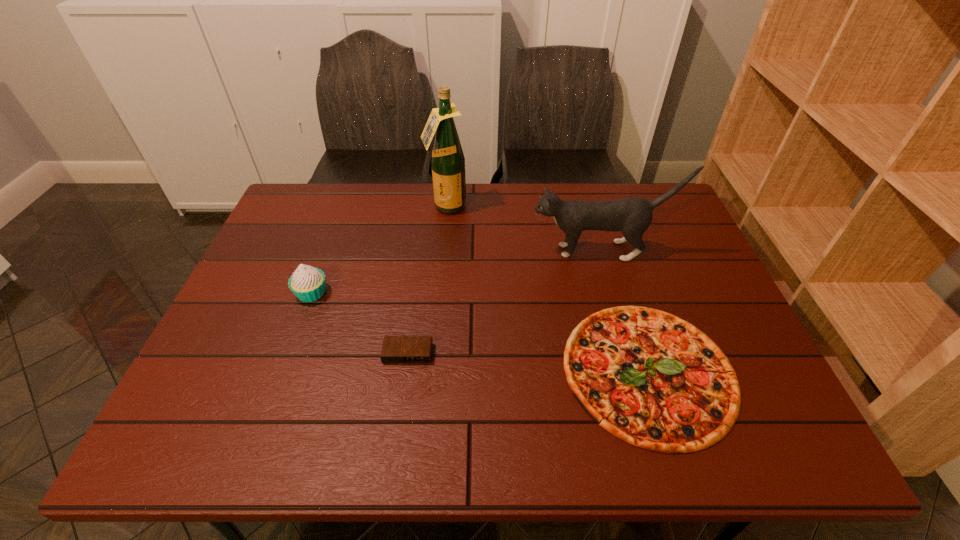
Locate an element on the screen. Image resolution: width=960 pixels, height=540 pixels. object situated at the near right corner is located at coordinates click(650, 378).

At what (x,y) coordinates should I click in order to perform the action: click on free space at the far edge of the desktop. Please return your answer as a coordinate pair (x, y). The width and height of the screenshot is (960, 540). Looking at the image, I should click on (500, 214).

In the image, there is a desktop. Where is `vacant space at the near edge`? vacant space at the near edge is located at coordinates (427, 455).

Image resolution: width=960 pixels, height=540 pixels. What are the coordinates of `free space at the left edge of the desktop` in the screenshot? It's located at (230, 310).

Find the location of a particular element. Image resolution: width=960 pixels, height=540 pixels. vacant area at the right edge is located at coordinates (710, 276).

Where is `free space at the far left corner`? free space at the far left corner is located at coordinates (297, 212).

At what (x,y) coordinates should I click in order to perform the action: click on vacant point at the near left corner. Please return your answer as a coordinate pair (x, y). The width and height of the screenshot is (960, 540). Looking at the image, I should click on (231, 446).

In order to click on free space at the near right corner in this screenshot , I will do `click(785, 456)`.

Image resolution: width=960 pixels, height=540 pixels. In order to click on free space between the farthest object and the third tallest object in this screenshot , I will do `click(379, 250)`.

This screenshot has height=540, width=960. What are the coordinates of `free space between the farthest object and the third tallest object` in the screenshot? It's located at (379, 250).